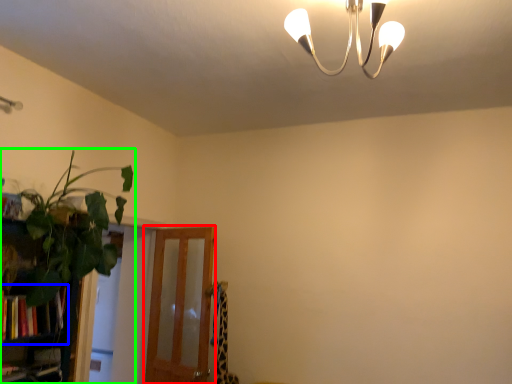
Question: Which object is positioned closest to screen door (highlighted by a red box)? Select from book (highlighted by a blue box) and houseplant (highlighted by a green box).

Choices:
 (A) book
 (B) houseplant

Answer: (B)